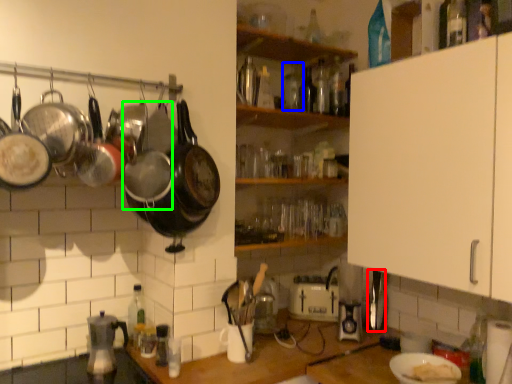
Question: Considering the real-world distances, which object is closest to appliance (highlighted by a red box)? bottle (highlighted by a blue box) or wok (highlighted by a green box).

Choices:
 (A) bottle
 (B) wok

Answer: (A)